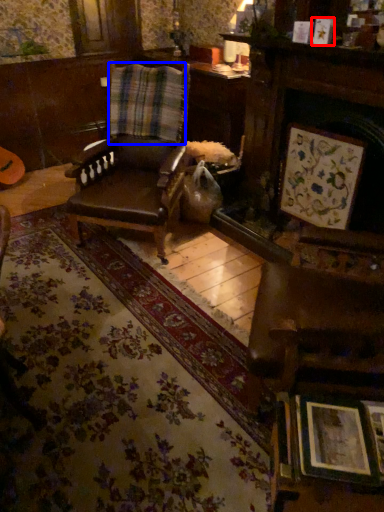
Question: Which point is closer to the camera, picture frame (highlighted by a red box) or curtain (highlighted by a blue box)?

Choices:
 (A) picture frame
 (B) curtain

Answer: (A)